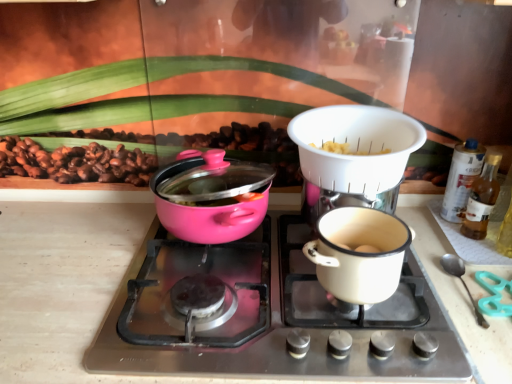
Question: From the image's perspective, is pink glossy pot at center left on top of translucent plastic spray can at right, placed as the first bottle when sorted from back to front?

Choices:
 (A) yes
 (B) no

Answer: (B)

Question: From a real-world perspective, is pink glossy pot at center left on translucent plastic spray can at right, placed as the first bottle when sorted from back to front?

Choices:
 (A) no
 (B) yes

Answer: (A)

Question: Is pink glossy pot at center left facing towards translucent plastic spray can at right, placed as the first bottle when sorted from back to front?

Choices:
 (A) yes
 (B) no

Answer: (B)

Question: Is pink glossy pot at center left further to the viewer compared to translucent plastic spray can at right, the 2th bottle when ordered from front to back?

Choices:
 (A) yes
 (B) no

Answer: (B)

Question: Does pink glossy pot at center left contain translucent plastic spray can at right, placed as the first bottle when sorted from back to front?

Choices:
 (A) yes
 (B) no

Answer: (B)

Question: Does pink glossy pot at center left come in front of translucent plastic spray can at right, the 2th bottle when ordered from front to back?

Choices:
 (A) no
 (B) yes

Answer: (B)

Question: Is pink glossy pot at left oriented away from pink glossy pot at center left?

Choices:
 (A) yes
 (B) no

Answer: (B)

Question: Can you confirm if pink glossy pot at left is thinner than pink glossy pot at center left?

Choices:
 (A) yes
 (B) no

Answer: (A)

Question: Is pink glossy pot at left positioned behind pink glossy pot at center left?

Choices:
 (A) yes
 (B) no

Answer: (A)

Question: Is there a large distance between pink glossy pot at left and pink glossy pot at center left?

Choices:
 (A) no
 (B) yes

Answer: (A)

Question: From the image's perspective, is pink glossy pot at left beneath pink glossy pot at center left?

Choices:
 (A) yes
 (B) no

Answer: (B)

Question: Is pink glossy pot at left beside pink glossy pot at center left?

Choices:
 (A) no
 (B) yes

Answer: (A)

Question: Is white plastic colander at upper center taller than translucent glass bottle at right, which appears as the second bottle when viewed from the back?

Choices:
 (A) yes
 (B) no

Answer: (B)